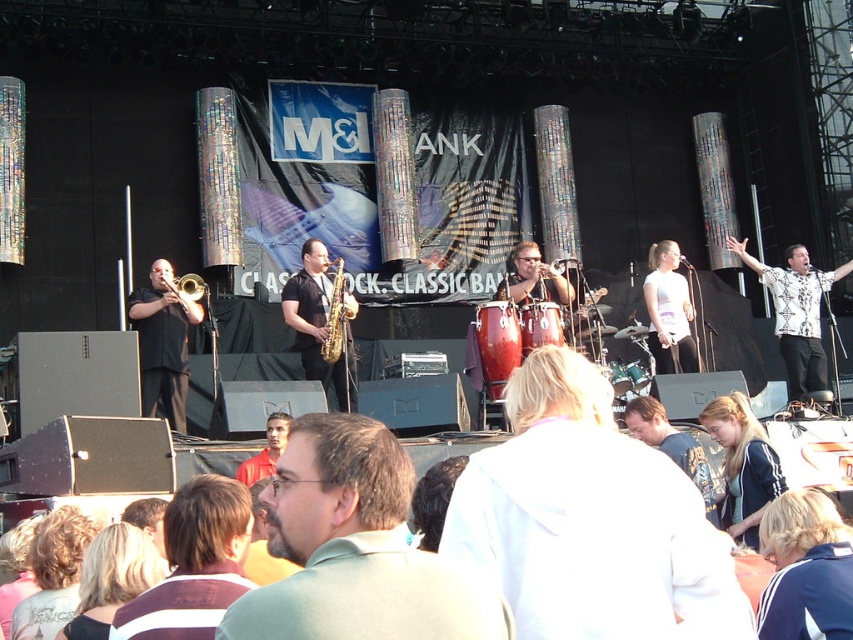
Question: Considering the relative positions of green matte shirt at center and blue fabric jacket at lower right in the image provided, where is green matte shirt at center located with respect to blue fabric jacket at lower right?

Choices:
 (A) above
 (B) below

Answer: (A)

Question: Which object is positioned closest to the white printed shirt at right?

Choices:
 (A) blonde hair at lower left
 (B) blue fabric jacket at lower right
 (C) matte gold trumpet at center

Answer: (C)

Question: Is green matte shirt at center to the left of brushed gold trumpet at left from the viewer's perspective?

Choices:
 (A) no
 (B) yes

Answer: (A)

Question: Which object is farther from the camera taking this photo?

Choices:
 (A) matte gold trumpet at left
 (B) blue athletic jacket at center
 (C) satin gold saxophone at center
 (D) blonde hair at center

Answer: (A)

Question: Does matte gold trumpet at center have a smaller size compared to dark brown hair at center?

Choices:
 (A) no
 (B) yes

Answer: (A)

Question: Among these points, which one is nearest to the camera?

Choices:
 (A) (97, 596)
 (B) (808, 316)
 (C) (186, 292)
 (D) (734, 433)

Answer: (A)